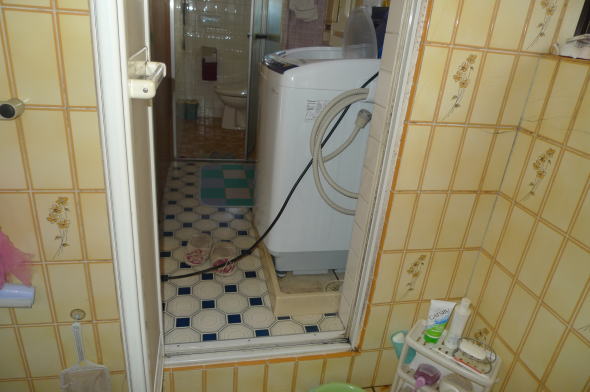
Locate an element on the screen. The height and width of the screenshot is (392, 590). sticker is located at coordinates (311, 105).